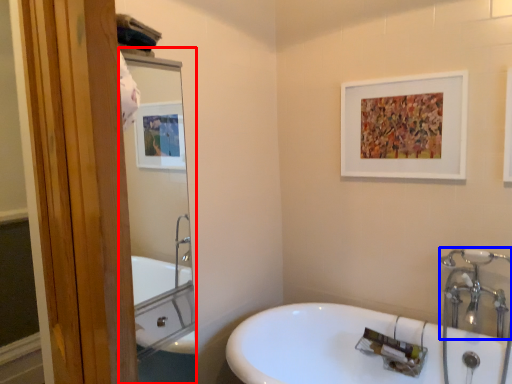
Question: Which object is further to the camera taking this photo, mirror (highlighted by a red box) or plumbing fixture (highlighted by a blue box)?

Choices:
 (A) mirror
 (B) plumbing fixture

Answer: (B)